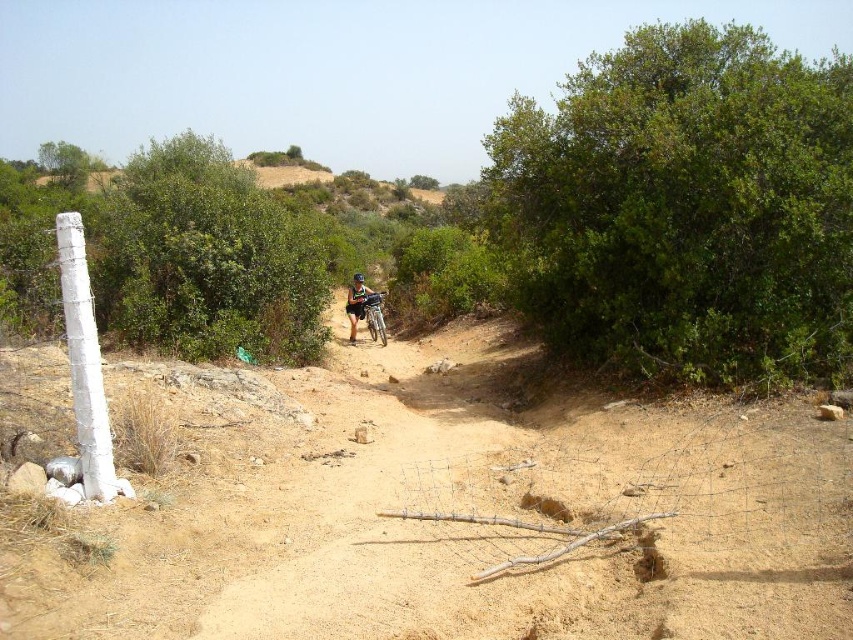
Question: Is silver metallic mountain bike at center to the left of green fabric shirt at center from the viewer's perspective?

Choices:
 (A) no
 (B) yes

Answer: (A)

Question: Which point is closer to the camera?

Choices:
 (A) (376, 308)
 (B) (368, 291)

Answer: (A)

Question: Can you confirm if silver metallic mountain bike at center is thinner than green fabric shirt at center?

Choices:
 (A) no
 (B) yes

Answer: (B)

Question: Which point is closer to the camera?

Choices:
 (A) (357, 321)
 (B) (363, 310)

Answer: (B)

Question: Does silver metallic mountain bike at center appear under green fabric shirt at center?

Choices:
 (A) no
 (B) yes

Answer: (B)